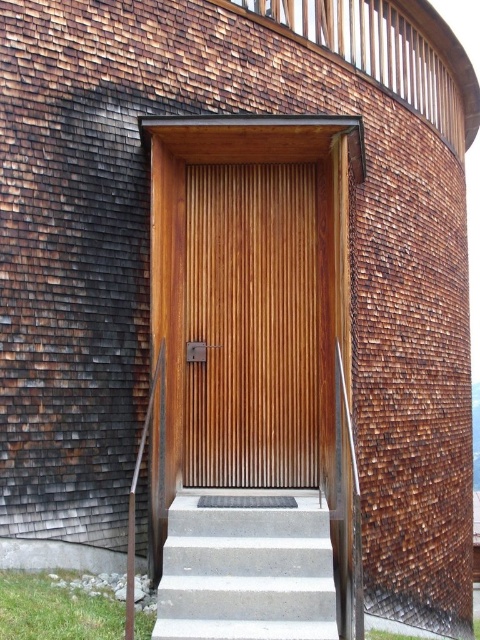
Between point (231, 170) and point (289, 525), which one is positioned behind?

The point (231, 170) is more distant.

Between wooden slats at center and concrete stairs at center, which one appears on the right side from the viewer's perspective?

wooden slats at center is more to the right.

Where is `wooden slats at center`? Image resolution: width=480 pixels, height=640 pixels. wooden slats at center is located at coordinates (251, 326).

Does concrete stairs at center appear over wooden textured rail at left?

No, concrete stairs at center is not above wooden textured rail at left.

Measure the distance from concrete stairs at center to wooden textured rail at left.

concrete stairs at center and wooden textured rail at left are 38.82 inches apart.

Find the location of a particular element. The width and height of the screenshot is (480, 640). concrete stairs at center is located at coordinates (247, 566).

Describe the element at coordinates (251, 326) in the screenshot. I see `wooden slats at center` at that location.

Does wooden slats at center come in front of wooden textured rail at left?

No, it is behind wooden textured rail at left.

You are a GUI agent. You are given a task and a screenshot of the screen. Output one action in this format:
    pyautogui.click(x=<x>, y=<y>)
    Task: Click on the wooden slats at center
    The image size is (480, 640).
    Given the screenshot: What is the action you would take?
    pyautogui.click(x=251, y=326)

Image resolution: width=480 pixels, height=640 pixels. I want to click on wooden slats at center, so click(251, 326).